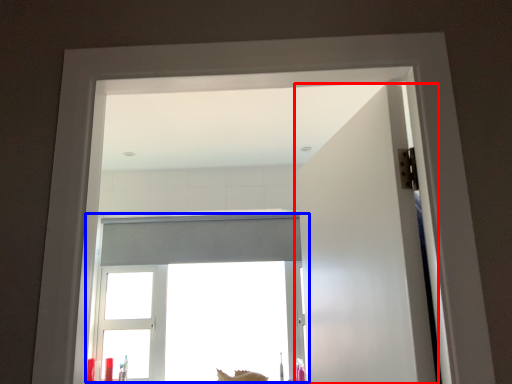
Question: Among these objects, which one is farthest to the camera, door (highlighted by a red box) or window (highlighted by a blue box)?

Choices:
 (A) door
 (B) window

Answer: (B)